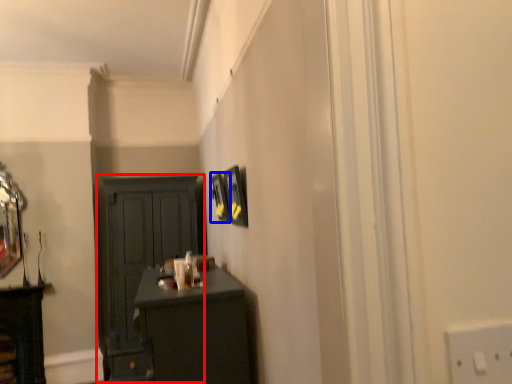
Question: Which point is further to the camera, cupboard (highlighted by a red box) or picture frame (highlighted by a blue box)?

Choices:
 (A) cupboard
 (B) picture frame

Answer: (A)